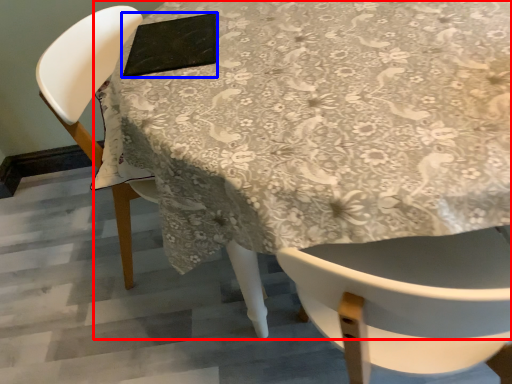
Question: Which object is further to the camera taking this photo, table (highlighted by a red box) or pad (highlighted by a blue box)?

Choices:
 (A) table
 (B) pad

Answer: (B)